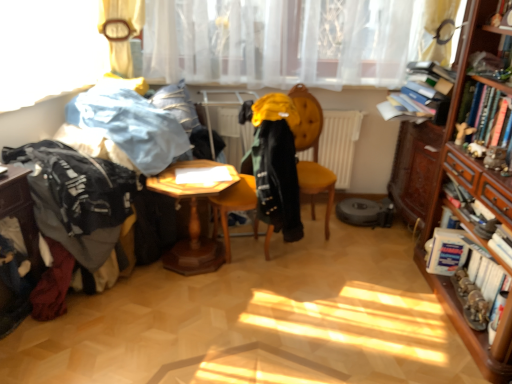
This screenshot has height=384, width=512. In order to click on vacant area that lies between velvet yellow chair at center and wooden bookcase at right in this screenshot , I will do `click(374, 276)`.